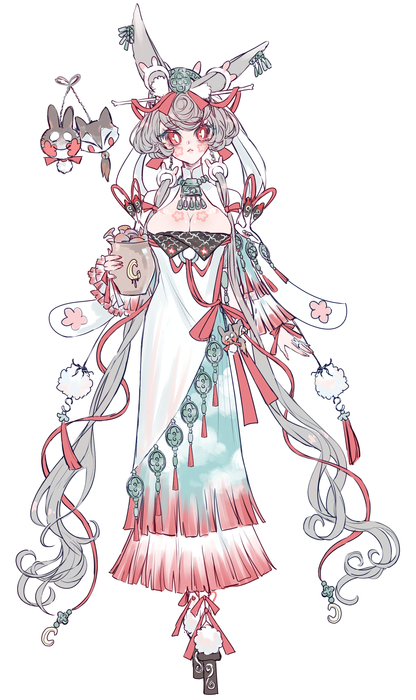
Find the location of a particular element. chest is located at coordinates (178, 211), (206, 214).